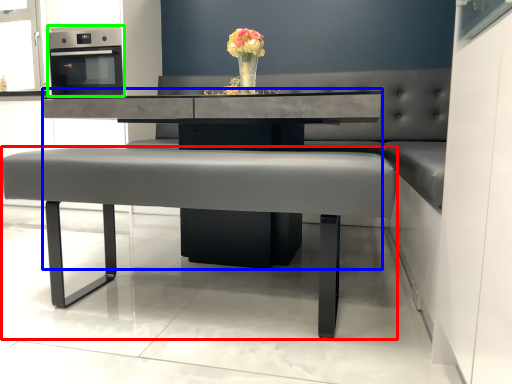
Question: Estimate the real-world distances between objects in this image. Which object is closer to table (highlighted by a red box), round table (highlighted by a blue box) or appliance (highlighted by a green box)?

Choices:
 (A) round table
 (B) appliance

Answer: (A)